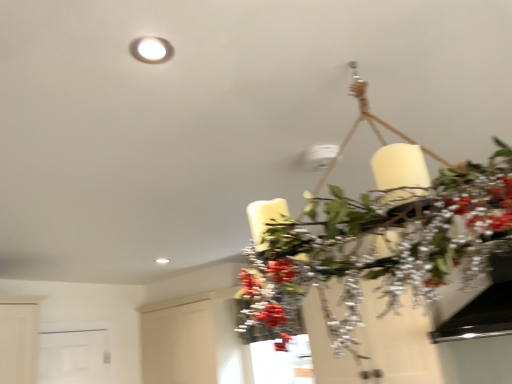
Describe the element at coordinates (270, 303) in the screenshot. I see `shiny metallic flower at center` at that location.

You are a GUI agent. You are given a task and a screenshot of the screen. Output one action in this format:
    pyautogui.click(x=<x>, y=<y>)
    Task: Click on the shiny metallic flower at center
    This screenshot has width=512, height=384.
    Given the screenshot: What is the action you would take?
    pyautogui.click(x=270, y=303)

Measure the distance between shiny metallic flower at center and camera.

shiny metallic flower at center is 72.19 centimeters away from camera.

What is the approximate height of shiny metallic flower at center?

14.26 inches.

At what (x,y) coordinates should I click in order to perform the action: click on shiny metallic flower at center. Please return your answer as a coordinate pair (x, y). Looking at the image, I should click on (270, 303).